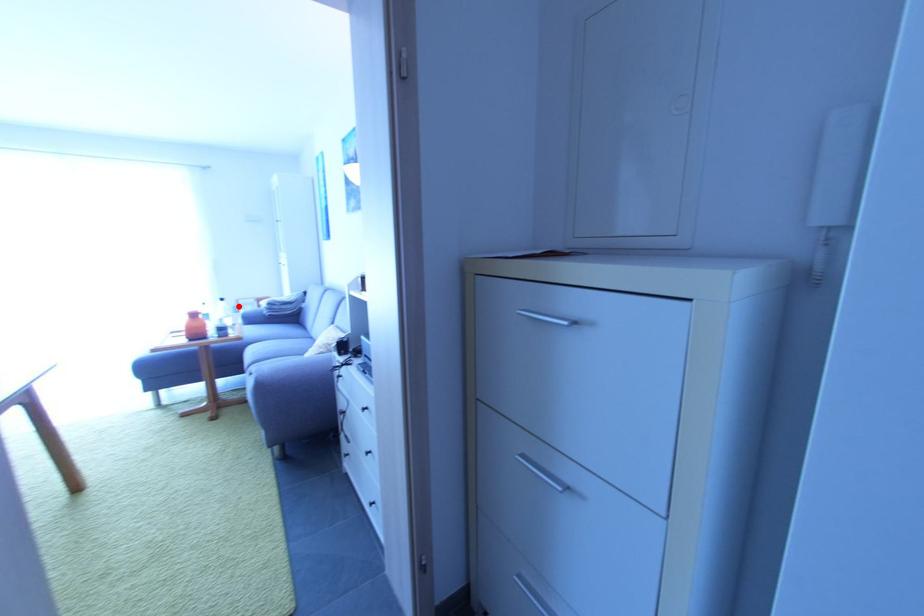
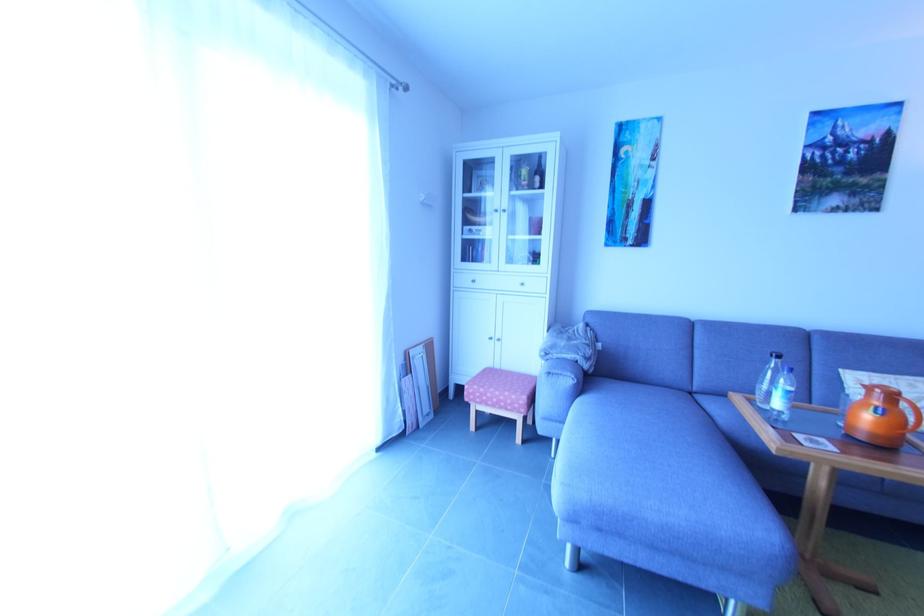
Find the pixel in the second image that matches the highlighted location in the first image.

(406, 362)